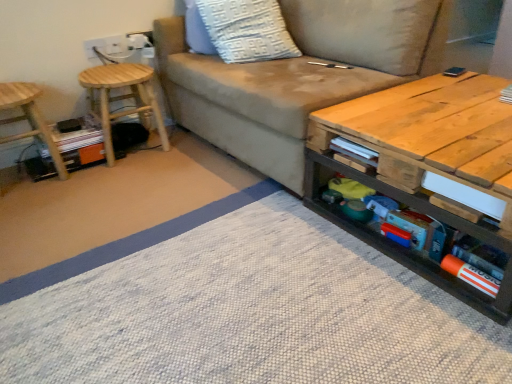
Question: From a real-world perspective, is suede beige couch at center located beneath wooden stool at left, positioned as the first stool in left-to-right order?

Choices:
 (A) no
 (B) yes

Answer: (A)

Question: Is suede beige couch at center shorter than wooden stool at left, positioned as the first stool in left-to-right order?

Choices:
 (A) no
 (B) yes

Answer: (A)

Question: Is wooden stool at left, placed as the 2th stool when sorted from right to left, surrounded by suede beige couch at center?

Choices:
 (A) yes
 (B) no

Answer: (B)

Question: Is the position of suede beige couch at center more distant than that of wooden stool at left, positioned as the first stool in left-to-right order?

Choices:
 (A) no
 (B) yes

Answer: (A)

Question: Are suede beige couch at center and wooden stool at left, placed as the 2th stool when sorted from right to left, making contact?

Choices:
 (A) yes
 (B) no

Answer: (B)

Question: Is suede beige couch at center thinner than wooden stool at left, positioned as the first stool in left-to-right order?

Choices:
 (A) yes
 (B) no

Answer: (B)

Question: Is orange matte book at lower right, placed as the 1th book when sorted from bottom to top, bigger than suede beige couch at center?

Choices:
 (A) yes
 (B) no

Answer: (B)

Question: Is orange matte book at lower right, positioned as the third book in top-to-bottom order, in front of suede beige couch at center?

Choices:
 (A) yes
 (B) no

Answer: (A)

Question: Is orange matte book at lower right, which appears as the third book when viewed from the back, taller than suede beige couch at center?

Choices:
 (A) yes
 (B) no

Answer: (B)

Question: Is orange matte book at lower right, positioned as the third book in top-to-bottom order, wider than suede beige couch at center?

Choices:
 (A) yes
 (B) no

Answer: (B)

Question: Is orange matte book at lower right, the second book in the left-to-right sequence, aimed at suede beige couch at center?

Choices:
 (A) no
 (B) yes

Answer: (A)

Question: Are orange matte book at lower right, which appears as the third book when viewed from the back, and suede beige couch at center beside each other?

Choices:
 (A) no
 (B) yes

Answer: (A)

Question: Considering the relative sizes of natural wood coffee table at center and orange matte book at lower right, arranged as the first book when viewed from the front, in the image provided, is natural wood coffee table at center smaller than orange matte book at lower right, arranged as the first book when viewed from the front,?

Choices:
 (A) no
 (B) yes

Answer: (A)